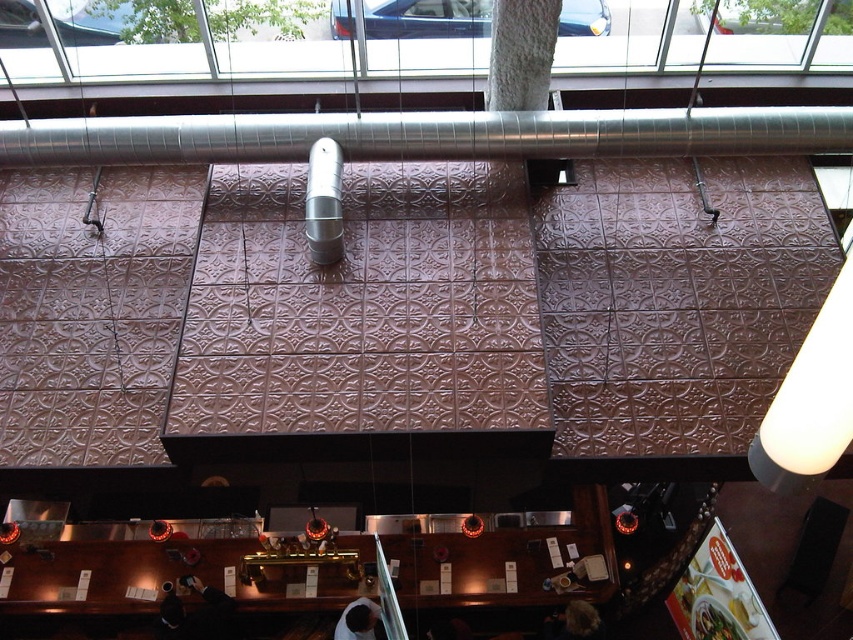
Does silver metallic exhaust hood at upper center appear under white matte lampshade at upper right?

Actually, silver metallic exhaust hood at upper center is above white matte lampshade at upper right.

Which is above, silver metallic exhaust hood at upper center or white matte lampshade at upper right?

silver metallic exhaust hood at upper center is above.

Does point (264, 145) come farther from viewer compared to point (820, 435)?

Yes, point (264, 145) is behind point (820, 435).

Locate an element on the screen. silver metallic exhaust hood at upper center is located at coordinates (426, 134).